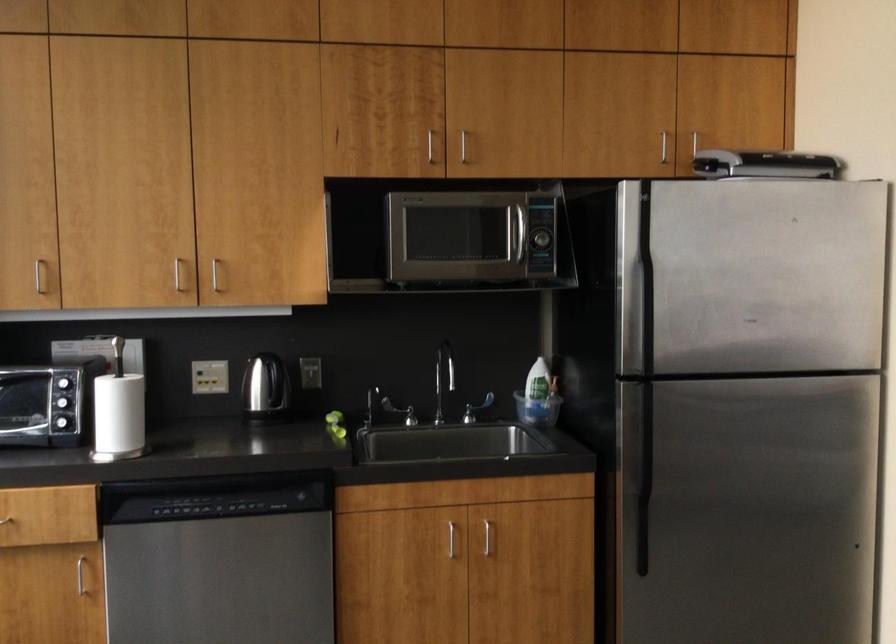
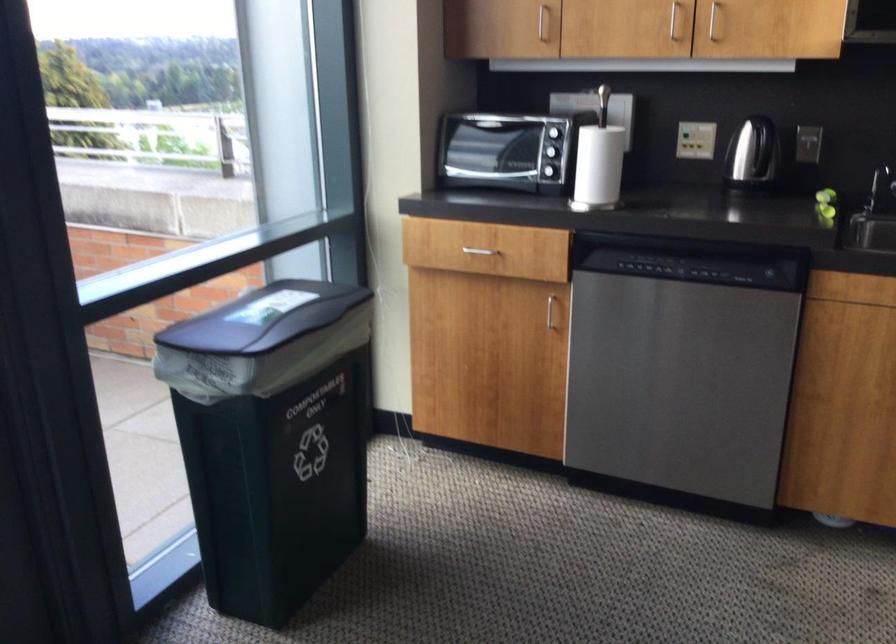
Where in the second image is the point corresponding to point 368,413 from the first image?

(879, 187)